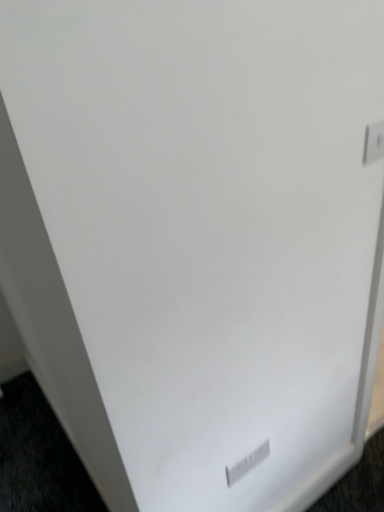
What do you see at coordinates (247, 463) in the screenshot?
I see `white plastic electric outlet at lower center, positioned as the 2th electric outlet in front-to-back order` at bounding box center [247, 463].

The width and height of the screenshot is (384, 512). Find the location of `white plastic electric outlet at lower center, positioned as the 2th electric outlet in front-to-back order`. white plastic electric outlet at lower center, positioned as the 2th electric outlet in front-to-back order is located at coordinates click(247, 463).

The image size is (384, 512). What do you see at coordinates (373, 143) in the screenshot?
I see `white plastic electric outlet at upper right, the second electric outlet in the bottom-to-top sequence` at bounding box center [373, 143].

The height and width of the screenshot is (512, 384). In order to click on white plastic electric outlet at upper right, positioned as the second electric outlet in left-to-right order in this screenshot , I will do `click(373, 143)`.

This screenshot has height=512, width=384. What are the coordinates of `white plastic electric outlet at lower center, positioned as the 2th electric outlet in front-to-back order` in the screenshot? It's located at (247, 463).

Which object is positioned more to the left, white plastic electric outlet at lower center, positioned as the 2th electric outlet in front-to-back order, or white plastic electric outlet at upper right, the second electric outlet viewed from the back?

white plastic electric outlet at lower center, positioned as the 2th electric outlet in front-to-back order.

Is the position of white plastic electric outlet at lower center, positioned as the 2th electric outlet in front-to-back order, more distant than that of white plastic electric outlet at upper right, which is the 1th electric outlet from front to back?

Yes.

Is point (264, 452) closer to camera compared to point (373, 127)?

No, it is not.

From the image's perspective, is white plastic electric outlet at lower center, positioned as the 1th electric outlet in left-to-right order, located beneath white plastic electric outlet at upper right, the 1th electric outlet in the right-to-left sequence?

Correct, white plastic electric outlet at lower center, positioned as the 1th electric outlet in left-to-right order, appears lower than white plastic electric outlet at upper right, the 1th electric outlet in the right-to-left sequence, in the image.

From a real-world perspective, is white plastic electric outlet at lower center, arranged as the 1th electric outlet when ordered from the bottom, positioned above or below white plastic electric outlet at upper right, marked as the 1th electric outlet in a top-to-bottom arrangement?

white plastic electric outlet at lower center, arranged as the 1th electric outlet when ordered from the bottom, is situated lower than white plastic electric outlet at upper right, marked as the 1th electric outlet in a top-to-bottom arrangement, in the real world.

Which of these two, white plastic electric outlet at lower center, acting as the first electric outlet starting from the back, or white plastic electric outlet at upper right, which is the 1th electric outlet from front to back, is wider?

white plastic electric outlet at lower center, acting as the first electric outlet starting from the back, is wider.

Looking at this image, is white plastic electric outlet at lower center, which is counted as the second electric outlet, starting from the top, taller than white plastic electric outlet at upper right, the second electric outlet viewed from the back?

Yes, white plastic electric outlet at lower center, which is counted as the second electric outlet, starting from the top, is taller than white plastic electric outlet at upper right, the second electric outlet viewed from the back.

Who is smaller, white plastic electric outlet at lower center, arranged as the 1th electric outlet when ordered from the bottom, or white plastic electric outlet at upper right, marked as the 1th electric outlet in a top-to-bottom arrangement?

Smaller between the two is white plastic electric outlet at upper right, marked as the 1th electric outlet in a top-to-bottom arrangement.

Would you say white plastic electric outlet at lower center, positioned as the 1th electric outlet in left-to-right order, is outside white plastic electric outlet at upper right, the 1th electric outlet in the right-to-left sequence?

Yes.

Are white plastic electric outlet at lower center, positioned as the 1th electric outlet in left-to-right order, and white plastic electric outlet at upper right, marked as the 1th electric outlet in a top-to-bottom arrangement, beside each other?

No, white plastic electric outlet at lower center, positioned as the 1th electric outlet in left-to-right order, is not with white plastic electric outlet at upper right, marked as the 1th electric outlet in a top-to-bottom arrangement.

Is white plastic electric outlet at lower center, positioned as the 1th electric outlet in left-to-right order, positioned with its back to white plastic electric outlet at upper right, positioned as the second electric outlet in left-to-right order?

No, white plastic electric outlet at lower center, positioned as the 1th electric outlet in left-to-right order, is not facing the opposite direction of white plastic electric outlet at upper right, positioned as the second electric outlet in left-to-right order.

What's the angular difference between white plastic electric outlet at lower center, arranged as the 1th electric outlet when ordered from the bottom, and white plastic electric outlet at upper right, positioned as the second electric outlet in left-to-right order,'s facing directions?

white plastic electric outlet at lower center, arranged as the 1th electric outlet when ordered from the bottom, and white plastic electric outlet at upper right, positioned as the second electric outlet in left-to-right order, are facing 1.23 degrees away from each other.

Identify the location of electric outlet behind the white plastic electric outlet at upper right, the second electric outlet viewed from the back. This screenshot has height=512, width=384. (247, 463).

Considering the relative positions of white plastic electric outlet at upper right, the second electric outlet in the bottom-to-top sequence, and white plastic electric outlet at lower center, positioned as the 1th electric outlet in left-to-right order, in the image provided, is white plastic electric outlet at upper right, the second electric outlet in the bottom-to-top sequence, to the right of white plastic electric outlet at lower center, positioned as the 1th electric outlet in left-to-right order, from the viewer's perspective?

Indeed, white plastic electric outlet at upper right, the second electric outlet in the bottom-to-top sequence, is positioned on the right side of white plastic electric outlet at lower center, positioned as the 1th electric outlet in left-to-right order.

Which object is closer to the camera taking this photo, white plastic electric outlet at upper right, the second electric outlet viewed from the back, or white plastic electric outlet at lower center, acting as the first electric outlet starting from the back?

Positioned in front is white plastic electric outlet at upper right, the second electric outlet viewed from the back.

Considering the positions of point (364, 140) and point (267, 454), is point (364, 140) closer or farther from the camera than point (267, 454)?

Point (364, 140) is positioned closer to the camera compared to point (267, 454).

From the image's perspective, is white plastic electric outlet at upper right, which is the 1th electric outlet from front to back, above or below white plastic electric outlet at lower center, which appears as the 2th electric outlet when viewed from the right?

white plastic electric outlet at upper right, which is the 1th electric outlet from front to back, is situated higher than white plastic electric outlet at lower center, which appears as the 2th electric outlet when viewed from the right, in the image.

From a real-world perspective, does white plastic electric outlet at upper right, the second electric outlet viewed from the back, sit lower than white plastic electric outlet at lower center, which appears as the 2th electric outlet when viewed from the right?

No, from a real-world perspective, white plastic electric outlet at upper right, the second electric outlet viewed from the back, is not under white plastic electric outlet at lower center, which appears as the 2th electric outlet when viewed from the right.

Does white plastic electric outlet at upper right, the 1th electric outlet in the right-to-left sequence, have a lesser width compared to white plastic electric outlet at lower center, positioned as the 2th electric outlet in front-to-back order?

Yes.

Considering the sizes of objects white plastic electric outlet at upper right, the 1th electric outlet in the right-to-left sequence, and white plastic electric outlet at lower center, arranged as the 1th electric outlet when ordered from the bottom, in the image provided, who is taller, white plastic electric outlet at upper right, the 1th electric outlet in the right-to-left sequence, or white plastic electric outlet at lower center, arranged as the 1th electric outlet when ordered from the bottom,?

With more height is white plastic electric outlet at lower center, arranged as the 1th electric outlet when ordered from the bottom.

In terms of size, does white plastic electric outlet at upper right, the second electric outlet viewed from the back, appear bigger or smaller than white plastic electric outlet at lower center, acting as the first electric outlet starting from the back?

white plastic electric outlet at upper right, the second electric outlet viewed from the back, is smaller than white plastic electric outlet at lower center, acting as the first electric outlet starting from the back.

Is white plastic electric outlet at upper right, the second electric outlet viewed from the back, surrounding white plastic electric outlet at lower center, which is counted as the second electric outlet, starting from the top?

No, white plastic electric outlet at upper right, the second electric outlet viewed from the back, does not contain white plastic electric outlet at lower center, which is counted as the second electric outlet, starting from the top.

From the picture: Does white plastic electric outlet at upper right, the 1th electric outlet in the right-to-left sequence, touch white plastic electric outlet at lower center, positioned as the 2th electric outlet in front-to-back order?

white plastic electric outlet at upper right, the 1th electric outlet in the right-to-left sequence, and white plastic electric outlet at lower center, positioned as the 2th electric outlet in front-to-back order, are not in contact.

Could you tell me if white plastic electric outlet at upper right, the second electric outlet in the bottom-to-top sequence, is facing white plastic electric outlet at lower center, arranged as the 1th electric outlet when ordered from the bottom?

A: No, white plastic electric outlet at upper right, the second electric outlet in the bottom-to-top sequence, does not turn towards white plastic electric outlet at lower center, arranged as the 1th electric outlet when ordered from the bottom.

Can you tell me how much white plastic electric outlet at upper right, the second electric outlet in the bottom-to-top sequence, and white plastic electric outlet at lower center, positioned as the 2th electric outlet in front-to-back order, differ in facing direction?

1.23 degrees.

Locate an element on the screen. Image resolution: width=384 pixels, height=512 pixels. electric outlet located in front of the white plastic electric outlet at lower center, acting as the first electric outlet starting from the back is located at coordinates (373, 143).

I want to click on electric outlet on the right of white plastic electric outlet at lower center, which is counted as the second electric outlet, starting from the top, so click(373, 143).

Locate an element on the screen. The height and width of the screenshot is (512, 384). electric outlet above the white plastic electric outlet at lower center, positioned as the 2th electric outlet in front-to-back order (from the image's perspective) is located at coordinates (373, 143).